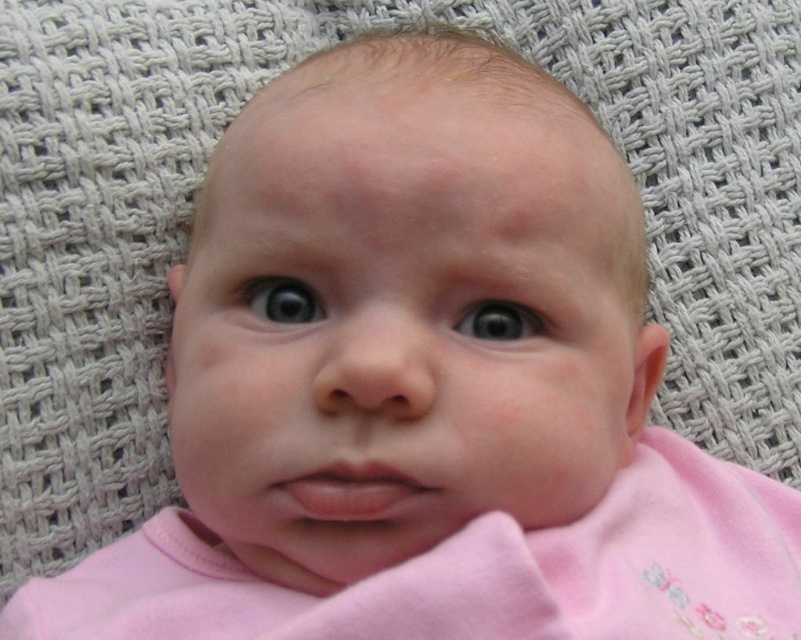
From the picture: You are a photographer adjusting the focus on your camera. You need to focus on two points in the image, point (244, 300) and point (528, 323). Which point is closer to you?

Point (244, 300) is closer to you than point (528, 323) because it is further to the viewer.

You are a photographer taking a close up of a baby. You notice the blue glossy eye at center and the gray matte eye at center. Which eye is closer to your camera?

The blue glossy eye at center is closer to the camera because it is further to the viewer than the gray matte eye at center.